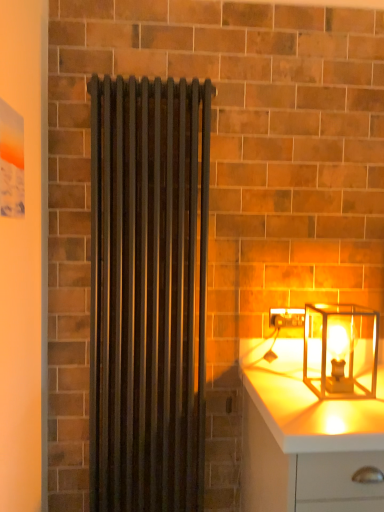
Find the location of `free spot behind translucent glass lantern at right`. free spot behind translucent glass lantern at right is located at coordinates (322, 364).